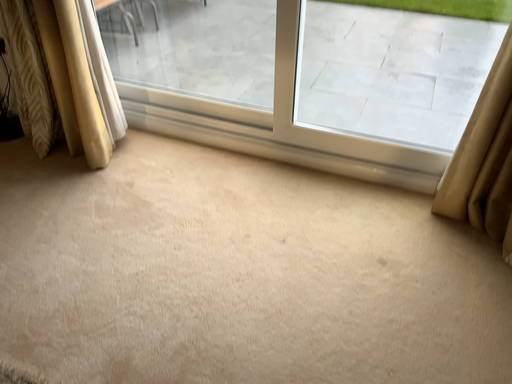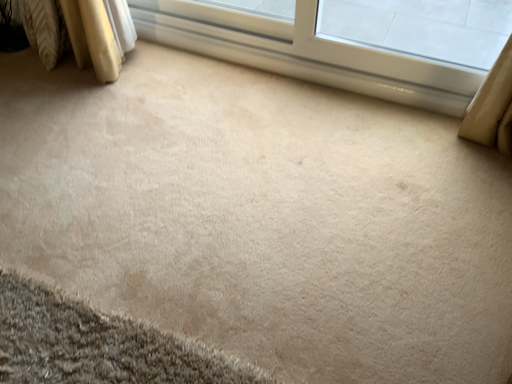
Question: Which way did the camera rotate in the video?

Choices:
 (A) rotated downward
 (B) rotated upward

Answer: (A)